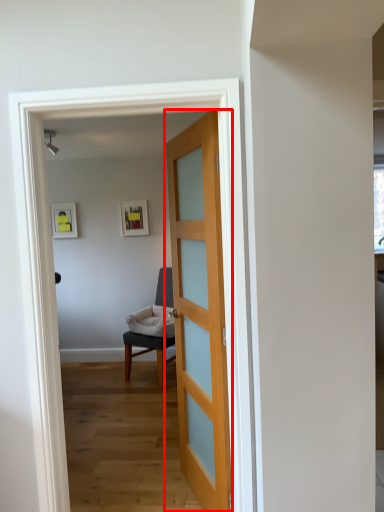
Question: Considering the relative positions of door (annotated by the red box) and chair in the image provided, where is door (annotated by the red box) located with respect to the staircase?

Choices:
 (A) right
 (B) left

Answer: (A)